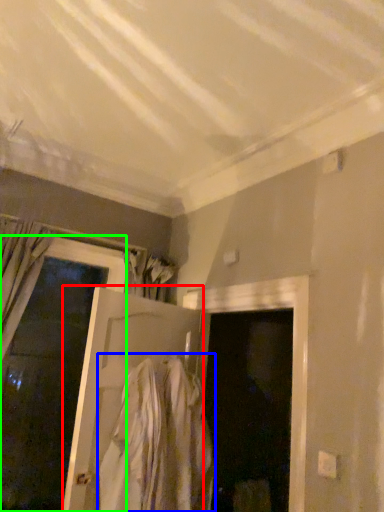
Question: Which object is positioned farthest from door (highlighted by a red box)? Select from clothing (highlighted by a blue box) and door (highlighted by a green box).

Choices:
 (A) clothing
 (B) door

Answer: (B)